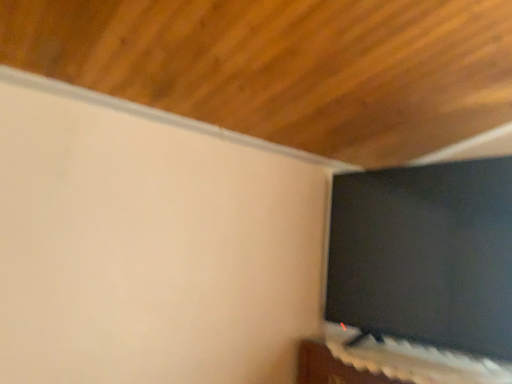
What do you see at coordinates (425, 256) in the screenshot? Image resolution: width=512 pixels, height=384 pixels. I see `black glossy monitor at lower right` at bounding box center [425, 256].

The height and width of the screenshot is (384, 512). Identify the location of black glossy monitor at lower right. (425, 256).

At what (x,y) coordinates should I click in order to perform the action: click on black glossy monitor at lower right. Please return your answer as a coordinate pair (x, y). The height and width of the screenshot is (384, 512). Looking at the image, I should click on (425, 256).